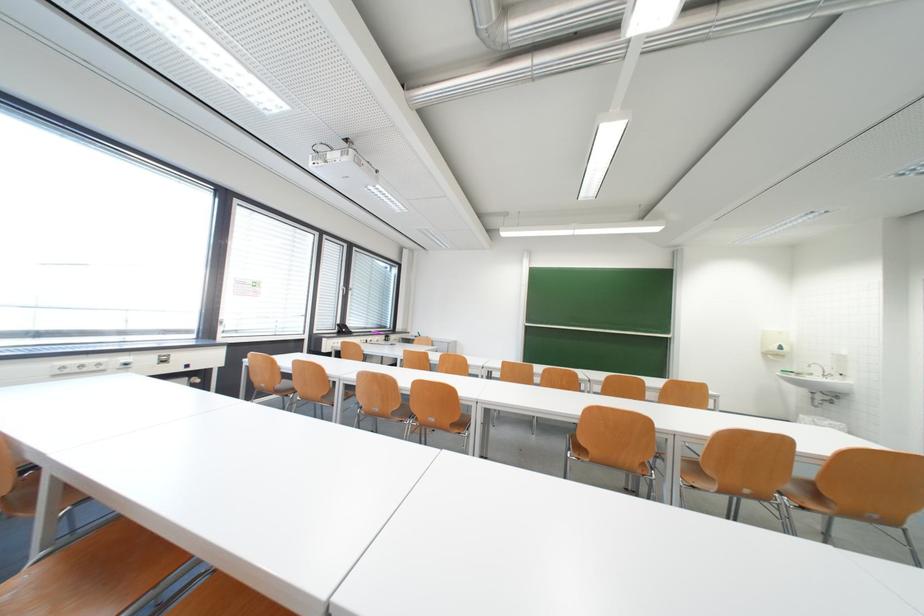
The height and width of the screenshot is (616, 924). In order to click on wall-mounted dispenser in this screenshot , I will do `click(774, 344)`.